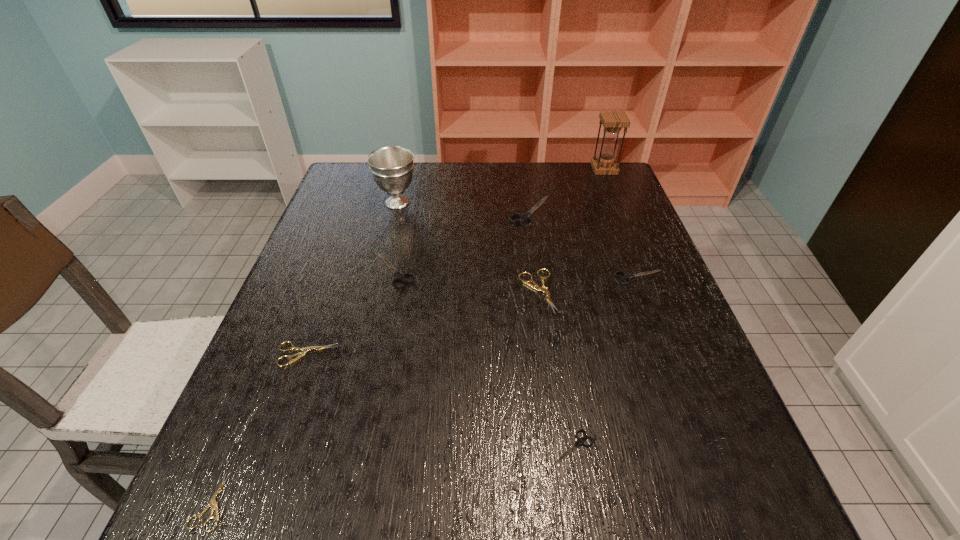
Locate an element on the screen. vacant space that satisfies the following two spatial constraints: 1. on the back side of the biggest beige shears; 2. on the right side of the second smallest black shears is located at coordinates (536, 277).

Locate an element on the screen. The width and height of the screenshot is (960, 540). free space that satisfies the following two spatial constraints: 1. on the back side of the fifth shears from right to left; 2. on the right side of the second nearest beige shears is located at coordinates (336, 270).